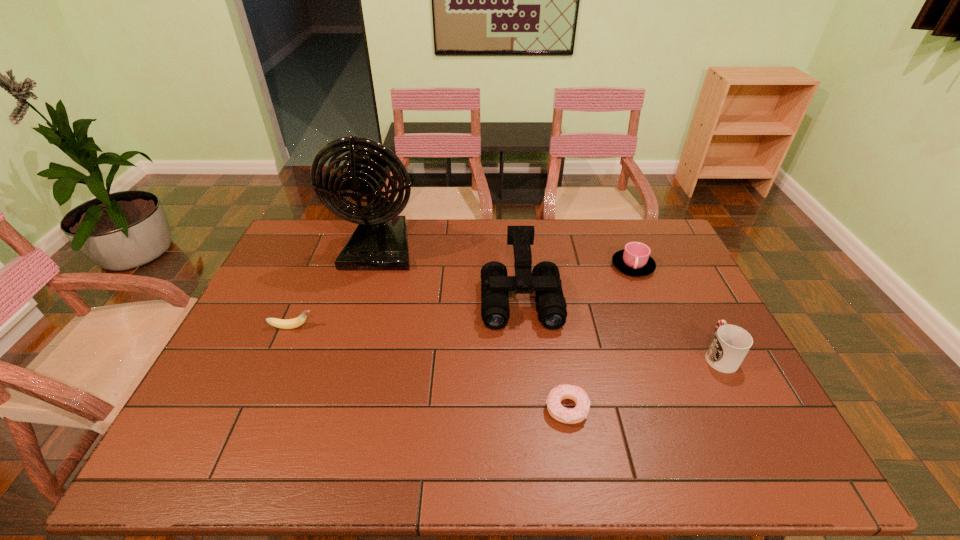
I want to click on free space between the tallest object and the banana, so click(x=336, y=288).

You are a GUI agent. You are given a task and a screenshot of the screen. Output one action in this format:
    pyautogui.click(x=<x>, y=<y>)
    Task: Click on the unoccupied position between the banana and the binoculars
    This screenshot has width=960, height=540.
    Given the screenshot: What is the action you would take?
    click(406, 313)

Image resolution: width=960 pixels, height=540 pixels. I want to click on unoccupied position between the banana and the tallest object, so click(x=336, y=288).

The image size is (960, 540). I want to click on vacant point located between the fan and the banana, so click(336, 288).

Find the location of a particular element. Image resolution: width=960 pixels, height=540 pixels. vacant area that lies between the fan and the binoculars is located at coordinates (450, 273).

At what (x,y) coordinates should I click in order to perform the action: click on object identified as the second closest to the nearest object. Please return your answer as a coordinate pair (x, y). Looking at the image, I should click on (731, 343).

Identify which object is the third nearest to the rightmost object. Please provide its 2D coordinates. Your answer should be formatted as a tuple, i.e. [(x, y)], where the tuple contains the x and y coordinates of a point satisfying the conditions above.

[(544, 279)]

Identify the location of vacant point that satisfies the following two spatial constraints: 1. at the stem of the banana; 2. on the handle side of the rightmost object. (280, 355).

The width and height of the screenshot is (960, 540). I want to click on free location that satisfies the following two spatial constraints: 1. in front of the tallest object to blow air; 2. at the stem of the banana, so click(x=358, y=327).

Identify the location of vacant space that satisfies the following two spatial constraints: 1. on the side with the handle of the farther cup; 2. at the stem of the banana. The height and width of the screenshot is (540, 960). (658, 327).